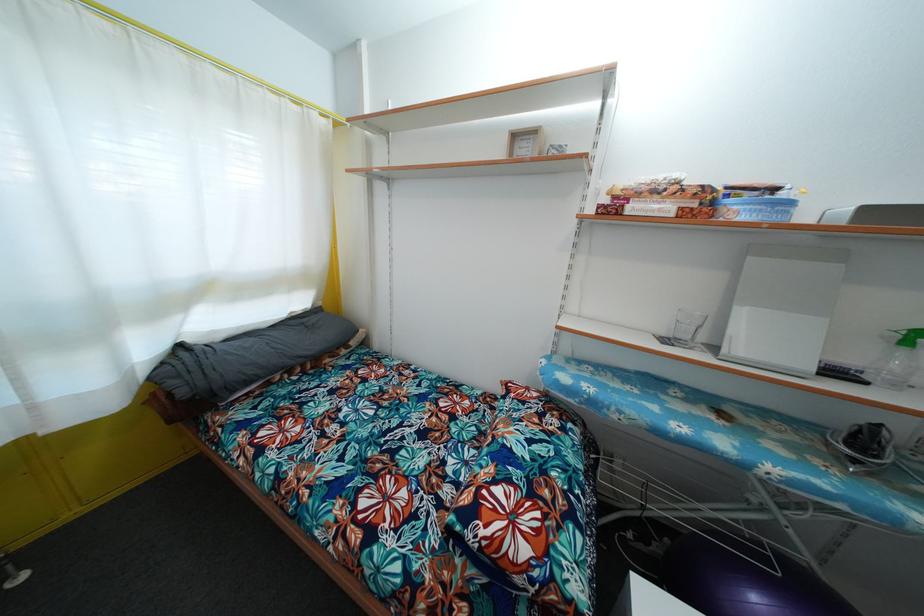
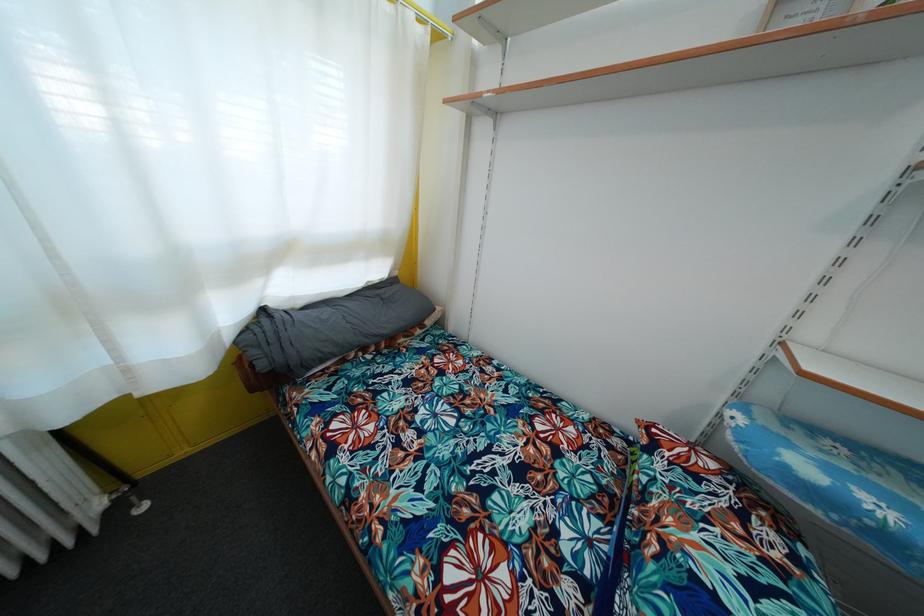
What movement of the cameraman would produce the second image?

The cameraman moved toward left, forward.